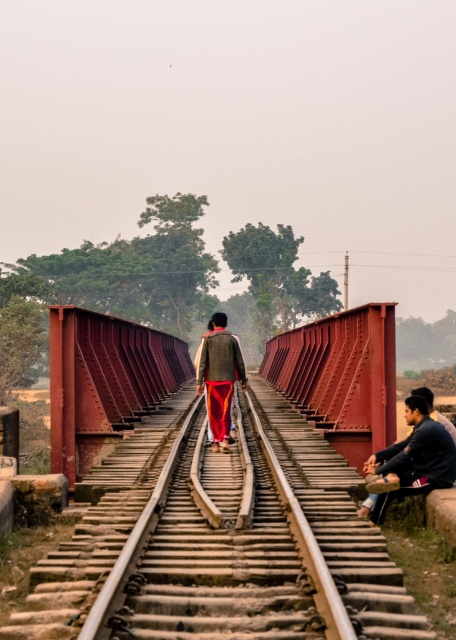
Question: Is rusty metal bridge at center to the left of textured woolen sweater at center from the viewer's perspective?

Choices:
 (A) yes
 (B) no

Answer: (A)

Question: Does rusty metal train track at center have a greater width compared to rusty metal bridge at center?

Choices:
 (A) no
 (B) yes

Answer: (A)

Question: Does rusty metal bridge at center have a greater width compared to dark blue fabric jacket at lower right?

Choices:
 (A) yes
 (B) no

Answer: (A)

Question: Estimate the real-world distances between objects in this image. Which object is farther from the rusty metal train track at center?

Choices:
 (A) rusty metal bridge at center
 (B) dark blue fabric jacket at lower right
 (C) textured woolen sweater at center

Answer: (A)

Question: Estimate the real-world distances between objects in this image. Which object is closer to the dark blue fabric jacket at lower right?

Choices:
 (A) rusty metal train track at center
 (B) textured woolen sweater at center
 (C) rusty metal bridge at center

Answer: (A)

Question: Which is farther from the rusty metal train track at center?

Choices:
 (A) textured woolen sweater at center
 (B) rusty metal bridge at center

Answer: (B)